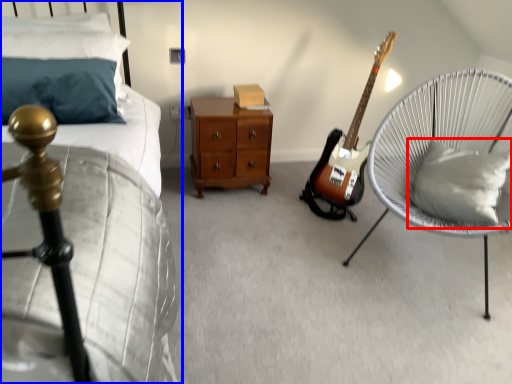
Question: Which object is further to the camera taking this photo, pillow (highlighted by a red box) or bed (highlighted by a blue box)?

Choices:
 (A) pillow
 (B) bed

Answer: (A)